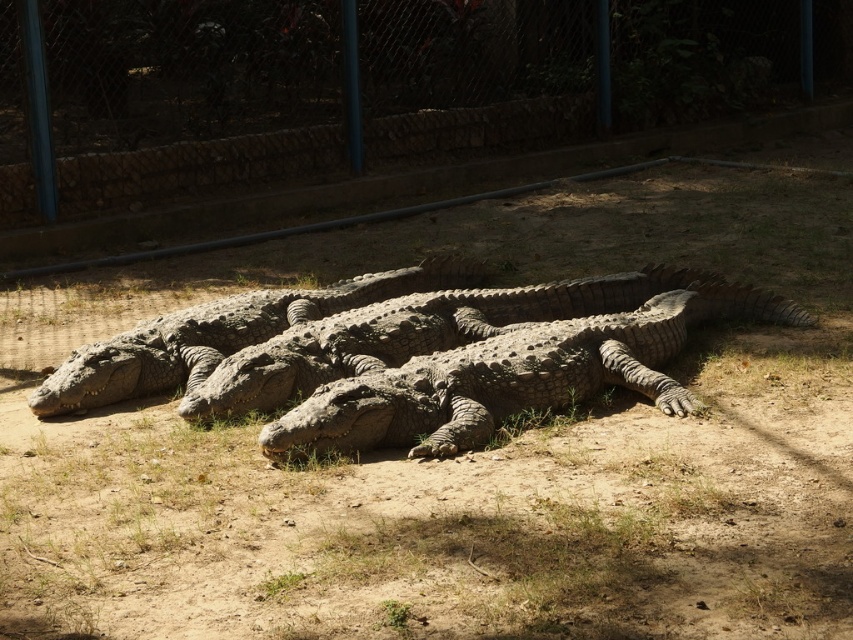
You are a zookeeper planning to install a new feeding station for the crocodiles. The feeding station requires a space larger than the rough textured crocodile at center. Can the metal fence at upper center provide enough space for this?

The metal fence at upper center has a smaller size compared to the rough textured crocodile at center, so it cannot provide enough space for the feeding station which requires a larger area than the crocodile.

You are a zookeeper responsible for feeding the crocodiles. You have a 1.5 meter long feeding stick. You need to feed both the rough textured crocodile at center and the gray textured crocodile at center. Can you safely reach both crocodiles with your feeding stick without moving closer than 1.40 meters from them?

The rough textured crocodile at center and gray textured crocodile at center are 1.40 meters apart from each other. Since your feeding stick is 1.5 meters long, you can safely reach both crocodiles without needing to move closer than 1.40 meters from them.

You are a zookeeper observing the crocodiles in their enclosure. You notice the metal fence at upper center and the rough textured crocodile at center. Which object is positioned to the right of the other?

The metal fence at upper center is to the right of the rough textured crocodile at center.